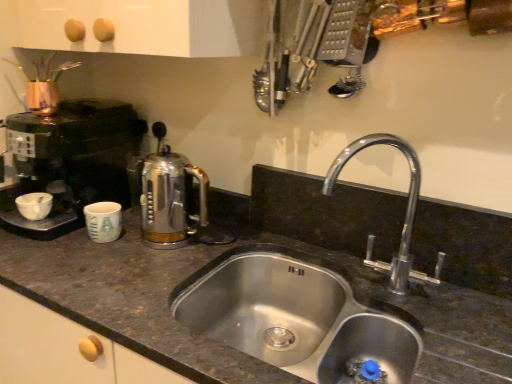
This screenshot has height=384, width=512. In order to click on stainless steel sink at center in this screenshot , I will do `click(296, 315)`.

The height and width of the screenshot is (384, 512). Identify the location of chrome metallic faucet at center right. (405, 215).

The height and width of the screenshot is (384, 512). What do you see at coordinates (405, 215) in the screenshot?
I see `chrome metallic faucet at center right` at bounding box center [405, 215].

Locate an element on the screen. The width and height of the screenshot is (512, 384). stainless steel sink at center is located at coordinates (296, 315).

Consider the image. Who is smaller, chrome metallic faucet at center right or stainless steel sink at center?

Smaller between the two is chrome metallic faucet at center right.

Is chrome metallic faucet at center right behind stainless steel sink at center?

Yes, chrome metallic faucet at center right is behind stainless steel sink at center.

Would you say chrome metallic faucet at center right is to the left or to the right of stainless steel sink at center in the picture?

From the image, it's evident that chrome metallic faucet at center right is to the right of stainless steel sink at center.

Find the location of a particular element. coffee machine above the white glossy bowl at left (from a real-world perspective) is located at coordinates (x=70, y=161).

Is white glossy bowl at left oriented towards black plastic coffee machine at left?

Yes, white glossy bowl at left is oriented towards black plastic coffee machine at left.

Is white glossy bowl at left not close to black plastic coffee machine at left?

No, white glossy bowl at left is not far from black plastic coffee machine at left.

Is point (113, 222) closer to camera compared to point (79, 196)?

Yes, it is.

Looking at this image, which object is further away from the camera taking this photo, matte ceramic mug at left or black plastic coffee machine at left?

matte ceramic mug at left is further away from the camera.

Based on the photo, considering the sizes of matte ceramic mug at left and black plastic coffee machine at left in the image, is matte ceramic mug at left bigger or smaller than black plastic coffee machine at left?

In the image, matte ceramic mug at left appears to be smaller than black plastic coffee machine at left.

You are a GUI agent. You are given a task and a screenshot of the screen. Output one action in this format:
    pyautogui.click(x=<x>, y=<y>)
    Task: Click on the mug below the black plastic coffee machine at left (from a real-world perspective)
    
    Given the screenshot: What is the action you would take?
    pyautogui.click(x=103, y=221)

Based on the photo, considering the sizes of white glossy bowl at left and chrome metallic faucet at center right in the image, is white glossy bowl at left wider or thinner than chrome metallic faucet at center right?

In the image, white glossy bowl at left appears to be more narrow than chrome metallic faucet at center right.

In the scene shown: Who is more distant, white glossy bowl at left or chrome metallic faucet at center right?

white glossy bowl at left is more distant.

Is white glossy bowl at left facing away from chrome metallic faucet at center right?

No, white glossy bowl at left's orientation is not away from chrome metallic faucet at center right.

Looking at this image, which of these two, white glossy bowl at left or chrome metallic faucet at center right, is bigger?

With larger size is chrome metallic faucet at center right.

From the image's perspective, between matte ceramic mug at left and satin chrome coffee pot at center, who is located below?

From the image's view, matte ceramic mug at left is below.

Is the surface of matte ceramic mug at left in direct contact with satin chrome coffee pot at center?

No, matte ceramic mug at left is not next to satin chrome coffee pot at center.

Is matte ceramic mug at left in front of satin chrome coffee pot at center?

No.

Between black plastic coffee machine at left and satin chrome coffee pot at center, which one has smaller size?

Smaller between the two is satin chrome coffee pot at center.

Can we say black plastic coffee machine at left lies outside satin chrome coffee pot at center?

Indeed, black plastic coffee machine at left is completely outside satin chrome coffee pot at center.

From a real-world perspective, is black plastic coffee machine at left physically above satin chrome coffee pot at center?

Indeed, from a real-world perspective, black plastic coffee machine at left stands above satin chrome coffee pot at center.

Considering the positions of objects black plastic coffee machine at left and satin chrome coffee pot at center in the image provided, who is more to the right, black plastic coffee machine at left or satin chrome coffee pot at center?

From the viewer's perspective, satin chrome coffee pot at center appears more on the right side.

Is satin chrome coffee pot at center facing towards stainless steel sink at center?

No, satin chrome coffee pot at center is not turned towards stainless steel sink at center.

Which is more to the left, satin chrome coffee pot at center or stainless steel sink at center?

From the viewer's perspective, satin chrome coffee pot at center appears more on the left side.

Does satin chrome coffee pot at center have a greater width compared to stainless steel sink at center?

No, satin chrome coffee pot at center is not wider than stainless steel sink at center.

Does point (177, 180) lie behind point (394, 349)?

That is True.

In order to click on tap on the right side of stainless steel sink at center in this screenshot , I will do `click(405, 215)`.

At what (x,y) coordinates should I click in order to perform the action: click on coffee machine in front of the white glossy bowl at left. Please return your answer as a coordinate pair (x, y). Looking at the image, I should click on (70, 161).

Based on their spatial positions, is black plastic coffee machine at left or satin chrome coffee pot at center further from matte ceramic mug at left?

black plastic coffee machine at left is positioned further to the anchor matte ceramic mug at left.

Looking at the image, which one is located closer to black plastic coffee machine at left, chrome metallic faucet at center right or matte ceramic mug at left?

Based on the image, matte ceramic mug at left appears to be nearer to black plastic coffee machine at left.

Estimate the real-world distances between objects in this image. Which object is closer to chrome metallic faucet at center right, white glossy bowl at left or satin chrome coffee pot at center?

The object closer to chrome metallic faucet at center right is satin chrome coffee pot at center.

Considering their positions, is white glossy bowl at left positioned closer to matte ceramic mug at left than chrome metallic faucet at center right?

white glossy bowl at left.

Based on the photo, which object lies nearer to the anchor point black plastic coffee machine at left, white glossy bowl at left or matte ceramic mug at left?

white glossy bowl at left is closer to black plastic coffee machine at left.

Which object lies nearer to the anchor point satin chrome coffee pot at center, white glossy bowl at left or black plastic coffee machine at left?

The object closer to satin chrome coffee pot at center is black plastic coffee machine at left.

From the image, which object appears to be farther from stainless steel sink at center, satin chrome coffee pot at center or black plastic coffee machine at left?

Based on the image, black plastic coffee machine at left appears to be further to stainless steel sink at center.

Looking at the image, which one is located further to stainless steel sink at center, white glossy bowl at left or satin chrome coffee pot at center?

white glossy bowl at left.

Image resolution: width=512 pixels, height=384 pixels. I want to click on sink situated between satin chrome coffee pot at center and chrome metallic faucet at center right from left to right, so click(296, 315).

I want to click on sink between matte ceramic mug at left and chrome metallic faucet at center right, so click(x=296, y=315).

Locate an element on the screen. coffeepot between matte ceramic mug at left and stainless steel sink at center from left to right is located at coordinates (169, 199).

I want to click on sink between black plastic coffee machine at left and chrome metallic faucet at center right from left to right, so click(296, 315).